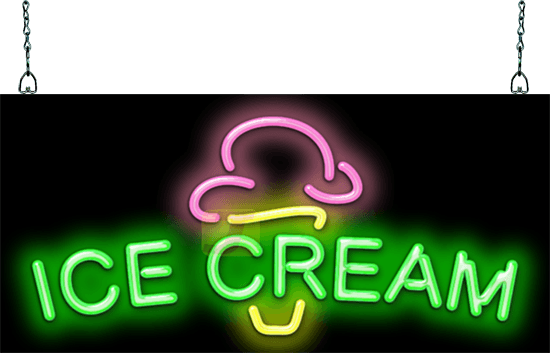
Where is `screws`? The image size is (550, 353). screws is located at coordinates (26, 2), (522, 1).